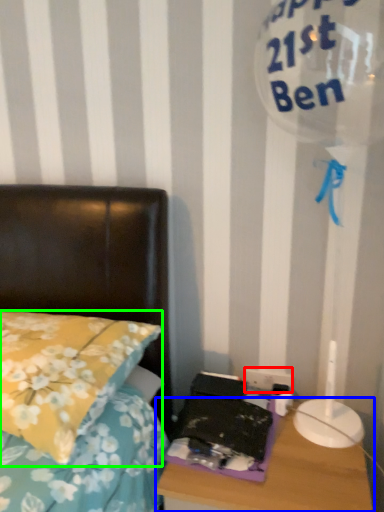
Question: Based on their relative distances, which object is farther from electric outlet (highlighted by a red box)? Choose from nightstand (highlighted by a blue box) and pillow (highlighted by a green box).

Choices:
 (A) nightstand
 (B) pillow

Answer: (B)